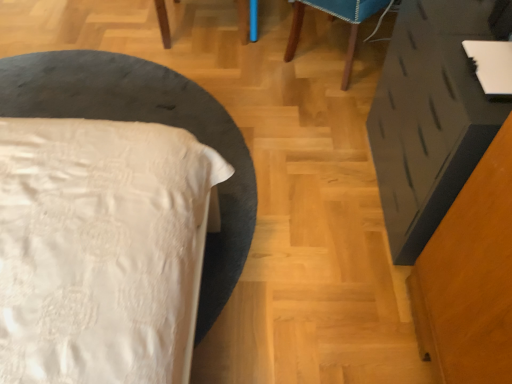
This screenshot has height=384, width=512. What are the coordinates of `free space in front of wooden chair at upper center` in the screenshot? It's located at (300, 154).